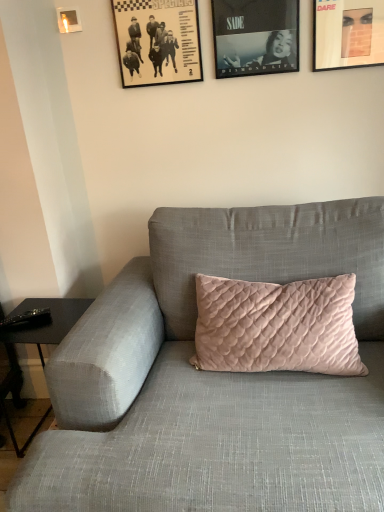
What is the approximate width of metallic gold picture frame at upper left, which ranks as the first picture frame in left-to-right order?

metallic gold picture frame at upper left, which ranks as the first picture frame in left-to-right order, is 0.92 inches wide.

Image resolution: width=384 pixels, height=512 pixels. Describe the element at coordinates (215, 379) in the screenshot. I see `velvet pink pillow at center` at that location.

Find the location of a particular element. Image resolution: width=384 pixels, height=512 pixels. matte black picture frame at upper center, marked as the 3th picture frame in a left-to-right arrangement is located at coordinates (255, 36).

Considering the sizes of objects black paper picture frame at upper center, the 2th picture frame in the left-to-right sequence, and velvet pink pillow at center in the image provided, who is shorter, black paper picture frame at upper center, the 2th picture frame in the left-to-right sequence, or velvet pink pillow at center?

black paper picture frame at upper center, the 2th picture frame in the left-to-right sequence.

Is velvet pink pillow at center inside black paper picture frame at upper center, arranged as the 3th picture frame when viewed from the right?

No, black paper picture frame at upper center, arranged as the 3th picture frame when viewed from the right, does not contain velvet pink pillow at center.

How far apart are black paper picture frame at upper center, the 2th picture frame in the left-to-right sequence, and velvet pink pillow at center?

black paper picture frame at upper center, the 2th picture frame in the left-to-right sequence, and velvet pink pillow at center are 35.99 inches apart.

From the picture: Considering the relative positions of velvet pink pillow at center and matte black picture frame at upper right, placed as the first picture frame when sorted from right to left, in the image provided, is velvet pink pillow at center to the right of matte black picture frame at upper right, placed as the first picture frame when sorted from right to left, from the viewer's perspective?

Incorrect, velvet pink pillow at center is not on the right side of matte black picture frame at upper right, placed as the first picture frame when sorted from right to left.

Consider the image. Does velvet pink pillow at center have a lesser height compared to matte black picture frame at upper right, placed as the first picture frame when sorted from right to left?

Incorrect, the height of velvet pink pillow at center does not fall short of that of matte black picture frame at upper right, placed as the first picture frame when sorted from right to left.

Considering the relative sizes of matte black picture frame at upper center, marked as the 3th picture frame in a left-to-right arrangement, and black paper picture frame at upper center, arranged as the 3th picture frame when viewed from the right, in the image provided, is matte black picture frame at upper center, marked as the 3th picture frame in a left-to-right arrangement, wider than black paper picture frame at upper center, arranged as the 3th picture frame when viewed from the right,?

No.

Is matte black picture frame at upper center, which is the 2th picture frame in right-to-left order, oriented away from black paper picture frame at upper center, the 2th picture frame in the left-to-right sequence?

No, matte black picture frame at upper center, which is the 2th picture frame in right-to-left order, is not facing away from black paper picture frame at upper center, the 2th picture frame in the left-to-right sequence.

From the image's perspective, which one is positioned higher, matte black picture frame at upper center, which is the 2th picture frame in right-to-left order, or black paper picture frame at upper center, arranged as the 3th picture frame when viewed from the right?

From the image's view, matte black picture frame at upper center, which is the 2th picture frame in right-to-left order, is above.

From a real-world perspective, which object stands above the other?

matte black picture frame at upper center, which is the 2th picture frame in right-to-left order.

From the image's perspective, is black paper picture frame at upper center, arranged as the 3th picture frame when viewed from the right, below matte black picture frame at upper center, marked as the 3th picture frame in a left-to-right arrangement?

Yes, from the image's perspective, black paper picture frame at upper center, arranged as the 3th picture frame when viewed from the right, is below matte black picture frame at upper center, marked as the 3th picture frame in a left-to-right arrangement.

Which is correct: black paper picture frame at upper center, the 2th picture frame in the left-to-right sequence, is inside matte black picture frame at upper center, marked as the 3th picture frame in a left-to-right arrangement, or outside of it?

black paper picture frame at upper center, the 2th picture frame in the left-to-right sequence, is outside matte black picture frame at upper center, marked as the 3th picture frame in a left-to-right arrangement.

Considering the sizes of objects black paper picture frame at upper center, arranged as the 3th picture frame when viewed from the right, and matte black picture frame at upper center, marked as the 3th picture frame in a left-to-right arrangement, in the image provided, who is bigger, black paper picture frame at upper center, arranged as the 3th picture frame when viewed from the right, or matte black picture frame at upper center, marked as the 3th picture frame in a left-to-right arrangement,?

black paper picture frame at upper center, arranged as the 3th picture frame when viewed from the right.

Is black paper picture frame at upper center, arranged as the 3th picture frame when viewed from the right, facing away from matte black picture frame at upper center, marked as the 3th picture frame in a left-to-right arrangement?

That's not correct — black paper picture frame at upper center, arranged as the 3th picture frame when viewed from the right, is not looking away from matte black picture frame at upper center, marked as the 3th picture frame in a left-to-right arrangement.

Is matte black picture frame at upper center, marked as the 3th picture frame in a left-to-right arrangement, turned away from metallic gold picture frame at upper left, the fourth picture frame viewed from the right?

No, matte black picture frame at upper center, marked as the 3th picture frame in a left-to-right arrangement, is not facing the opposite direction of metallic gold picture frame at upper left, the fourth picture frame viewed from the right.

Considering the positions of points (256, 37) and (77, 18), is point (256, 37) closer to camera compared to point (77, 18)?

That is True.

From the image's perspective, which one is positioned lower, matte black picture frame at upper center, marked as the 3th picture frame in a left-to-right arrangement, or metallic gold picture frame at upper left, the fourth picture frame viewed from the right?

matte black picture frame at upper center, marked as the 3th picture frame in a left-to-right arrangement, from the image's perspective.

Is the surface of matte black picture frame at upper center, marked as the 3th picture frame in a left-to-right arrangement, in direct contact with metallic gold picture frame at upper left, the fourth picture frame viewed from the right?

matte black picture frame at upper center, marked as the 3th picture frame in a left-to-right arrangement, and metallic gold picture frame at upper left, the fourth picture frame viewed from the right, are clearly separated.

From the image's perspective, does metallic gold picture frame at upper left, the fourth picture frame viewed from the right, appear lower than matte black picture frame at upper center, marked as the 3th picture frame in a left-to-right arrangement?

Incorrect, from the image's perspective, metallic gold picture frame at upper left, the fourth picture frame viewed from the right, is higher than matte black picture frame at upper center, marked as the 3th picture frame in a left-to-right arrangement.

Between metallic gold picture frame at upper left, the fourth picture frame viewed from the right, and matte black picture frame at upper center, marked as the 3th picture frame in a left-to-right arrangement, which one has larger width?

With larger width is matte black picture frame at upper center, marked as the 3th picture frame in a left-to-right arrangement.

From a real-world perspective, between metallic gold picture frame at upper left, which ranks as the first picture frame in left-to-right order, and matte black picture frame at upper center, which is the 2th picture frame in right-to-left order, who is vertically higher?

In real-world perspective, metallic gold picture frame at upper left, which ranks as the first picture frame in left-to-right order, is above.

Does point (67, 22) appear closer or farther from the camera than point (230, 51)?

Point (67, 22) is positioned closer to the camera compared to point (230, 51).

Is matte black picture frame at upper center, marked as the 3th picture frame in a left-to-right arrangement, a part of velvet pink pillow at center?

Definitely not — matte black picture frame at upper center, marked as the 3th picture frame in a left-to-right arrangement, is not inside velvet pink pillow at center.

Which point is more forward, [264,221] or [243,40]?

Positioned in front is point [264,221].

Considering the relative sizes of velvet pink pillow at center and matte black picture frame at upper center, marked as the 3th picture frame in a left-to-right arrangement, in the image provided, is velvet pink pillow at center bigger than matte black picture frame at upper center, marked as the 3th picture frame in a left-to-right arrangement,?

Indeed, velvet pink pillow at center has a larger size compared to matte black picture frame at upper center, marked as the 3th picture frame in a left-to-right arrangement.

Does velvet pink pillow at center turn towards matte black picture frame at upper center, which is the 2th picture frame in right-to-left order?

No.

The width and height of the screenshot is (384, 512). What are the coordinates of `picture frame that is the 1st one when counting upward from the velvet pink pillow at center (from the image's perspective)` in the screenshot? It's located at (158, 41).

Find the location of a particular element. studio couch in front of the matte black picture frame at upper right, which ranks as the 4th picture frame in left-to-right order is located at coordinates (215, 379).

Estimate the real-world distances between objects in this image. Which object is further from matte black picture frame at upper center, which is the 2th picture frame in right-to-left order, velvet pink pillow at center or matte black picture frame at upper right, placed as the first picture frame when sorted from right to left?

velvet pink pillow at center.

Which object lies nearer to the anchor point matte black picture frame at upper center, which is the 2th picture frame in right-to-left order, black paper picture frame at upper center, arranged as the 3th picture frame when viewed from the right, or velvet pink pillow at center?

Among the two, black paper picture frame at upper center, arranged as the 3th picture frame when viewed from the right, is located nearer to matte black picture frame at upper center, which is the 2th picture frame in right-to-left order.

From the image, which object appears to be nearer to velvet pink pillow at center, matte black picture frame at upper center, which is the 2th picture frame in right-to-left order, or black paper picture frame at upper center, the 2th picture frame in the left-to-right sequence?

black paper picture frame at upper center, the 2th picture frame in the left-to-right sequence.

Estimate the real-world distances between objects in this image. Which object is closer to matte black picture frame at upper right, which ranks as the 4th picture frame in left-to-right order, matte black picture frame at upper center, which is the 2th picture frame in right-to-left order, or velvet pink pillow at center?

matte black picture frame at upper center, which is the 2th picture frame in right-to-left order.

Which object lies further to the anchor point metallic gold picture frame at upper left, which ranks as the first picture frame in left-to-right order, black paper picture frame at upper center, the 2th picture frame in the left-to-right sequence, or velvet pink pillow at center?

velvet pink pillow at center is positioned further to the anchor metallic gold picture frame at upper left, which ranks as the first picture frame in left-to-right order.

Considering their positions, is black paper picture frame at upper center, arranged as the 3th picture frame when viewed from the right, positioned further to velvet pink pillow at center than matte black picture frame at upper right, which ranks as the 4th picture frame in left-to-right order?

matte black picture frame at upper right, which ranks as the 4th picture frame in left-to-right order.

Based on their spatial positions, is velvet pink pillow at center or matte black picture frame at upper center, marked as the 3th picture frame in a left-to-right arrangement, closer to metallic gold picture frame at upper left, which ranks as the first picture frame in left-to-right order?

matte black picture frame at upper center, marked as the 3th picture frame in a left-to-right arrangement, is closer to metallic gold picture frame at upper left, which ranks as the first picture frame in left-to-right order.

When comparing their distances from matte black picture frame at upper right, placed as the first picture frame when sorted from right to left, does metallic gold picture frame at upper left, which ranks as the first picture frame in left-to-right order, or velvet pink pillow at center seem further?

metallic gold picture frame at upper left, which ranks as the first picture frame in left-to-right order, is further to matte black picture frame at upper right, placed as the first picture frame when sorted from right to left.

I want to click on picture frame between black paper picture frame at upper center, arranged as the 3th picture frame when viewed from the right, and matte black picture frame at upper right, placed as the first picture frame when sorted from right to left, in the horizontal direction, so click(x=255, y=36).

Locate an element on the screen. picture frame between matte black picture frame at upper center, which is the 2th picture frame in right-to-left order, and velvet pink pillow at center, in the vertical direction is located at coordinates (158, 41).

In order to click on picture frame between metallic gold picture frame at upper left, which ranks as the first picture frame in left-to-right order, and matte black picture frame at upper center, marked as the 3th picture frame in a left-to-right arrangement, in the horizontal direction in this screenshot , I will do `click(158, 41)`.